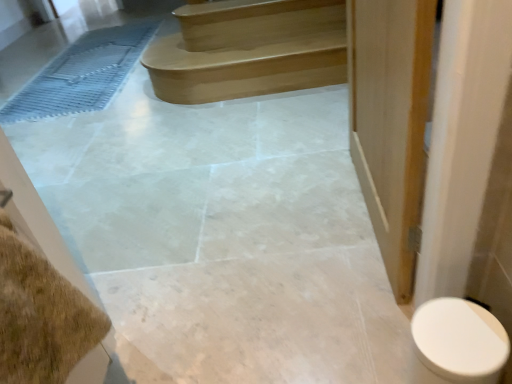
Question: Does satin wood stairs at upper center come behind white glossy toilet at lower right?

Choices:
 (A) no
 (B) yes

Answer: (B)

Question: Can you confirm if satin wood stairs at upper center is shorter than white glossy toilet at lower right?

Choices:
 (A) no
 (B) yes

Answer: (B)

Question: Is white glossy toilet at lower right at the back of satin wood stairs at upper center?

Choices:
 (A) no
 (B) yes

Answer: (A)

Question: Does satin wood stairs at upper center have a lesser width compared to white glossy toilet at lower right?

Choices:
 (A) yes
 (B) no

Answer: (B)

Question: Is white glossy toilet at lower right located within satin wood stairs at upper center?

Choices:
 (A) yes
 (B) no

Answer: (B)

Question: From a real-world perspective, is white glossy toilet at lower right above or below blue rubber bath mat at left?

Choices:
 (A) below
 (B) above

Answer: (B)

Question: Considering the positions of white glossy toilet at lower right and blue rubber bath mat at left in the image, is white glossy toilet at lower right taller or shorter than blue rubber bath mat at left?

Choices:
 (A) short
 (B) tall

Answer: (B)

Question: Relative to blue rubber bath mat at left, is white glossy toilet at lower right in front or behind?

Choices:
 (A) behind
 (B) front

Answer: (B)

Question: Does point (480, 347) appear closer or farther from the camera than point (10, 99)?

Choices:
 (A) farther
 (B) closer

Answer: (B)

Question: Is satin wood stairs at upper center spatially inside white glossy toilet at lower right, or outside of it?

Choices:
 (A) outside
 (B) inside

Answer: (A)

Question: From the image's perspective, relative to white glossy toilet at lower right, is satin wood stairs at upper center above or below?

Choices:
 (A) below
 (B) above

Answer: (B)

Question: Visually, is satin wood stairs at upper center positioned to the left or to the right of white glossy toilet at lower right?

Choices:
 (A) right
 (B) left

Answer: (B)

Question: Considering the positions of satin wood stairs at upper center and white glossy toilet at lower right in the image, is satin wood stairs at upper center wider or thinner than white glossy toilet at lower right?

Choices:
 (A) thin
 (B) wide

Answer: (B)

Question: Considering the positions of point (424, 327) and point (209, 3), is point (424, 327) closer or farther from the camera than point (209, 3)?

Choices:
 (A) farther
 (B) closer

Answer: (B)

Question: Choose the correct answer: Is white glossy toilet at lower right inside satin wood stairs at upper center or outside it?

Choices:
 (A) outside
 (B) inside

Answer: (A)